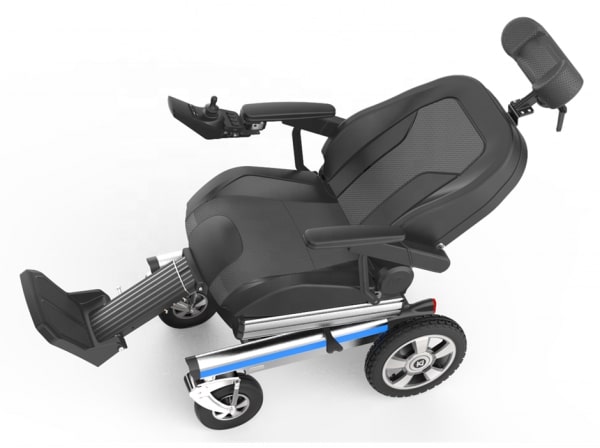
This screenshot has width=600, height=448. I want to click on left side of headrest, so click(x=551, y=84).